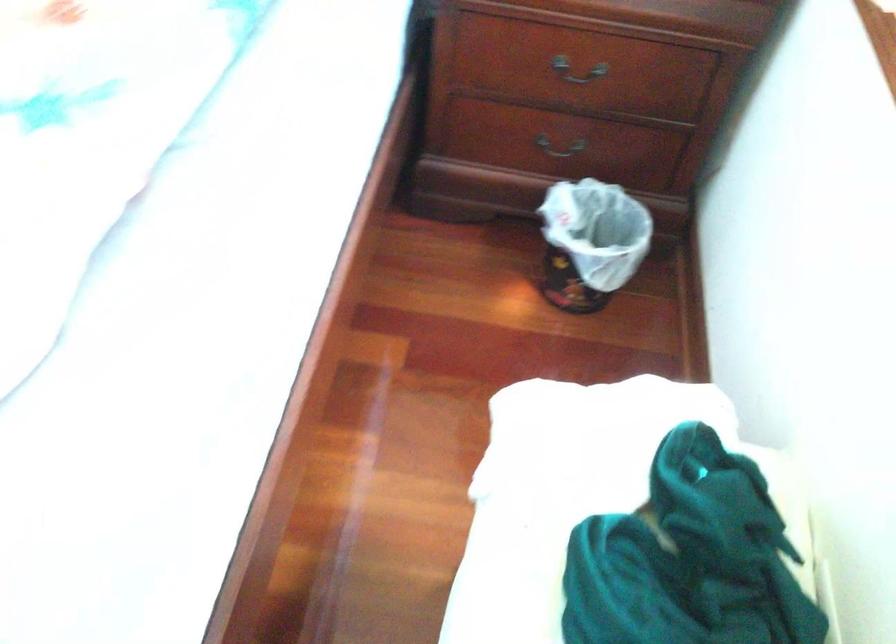
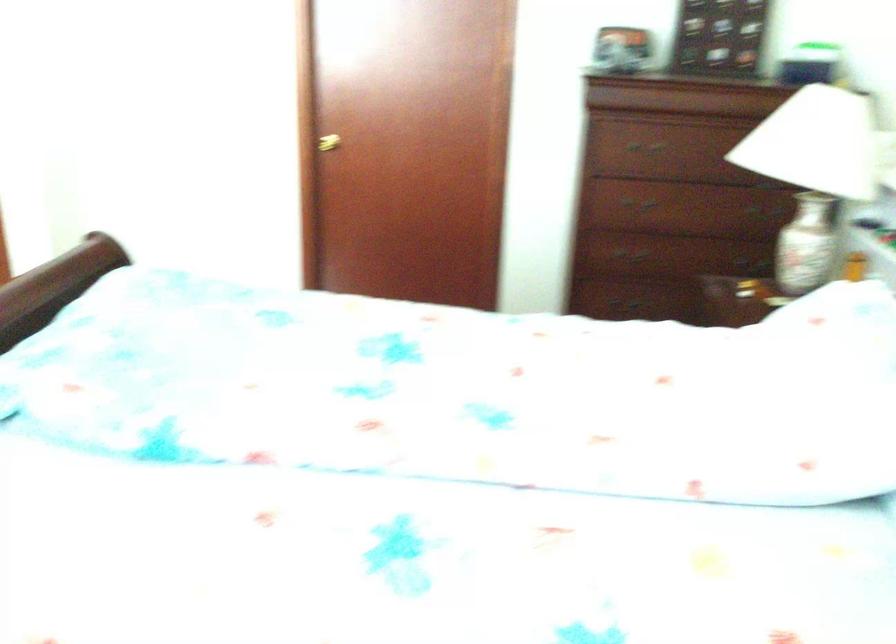
Question: The images are taken continuously from a first-person perspective. In which direction is your viewpoint rotating?

Choices:
 (A) Left
 (B) Right
 (C) Up
 (D) Down

Answer: (A)